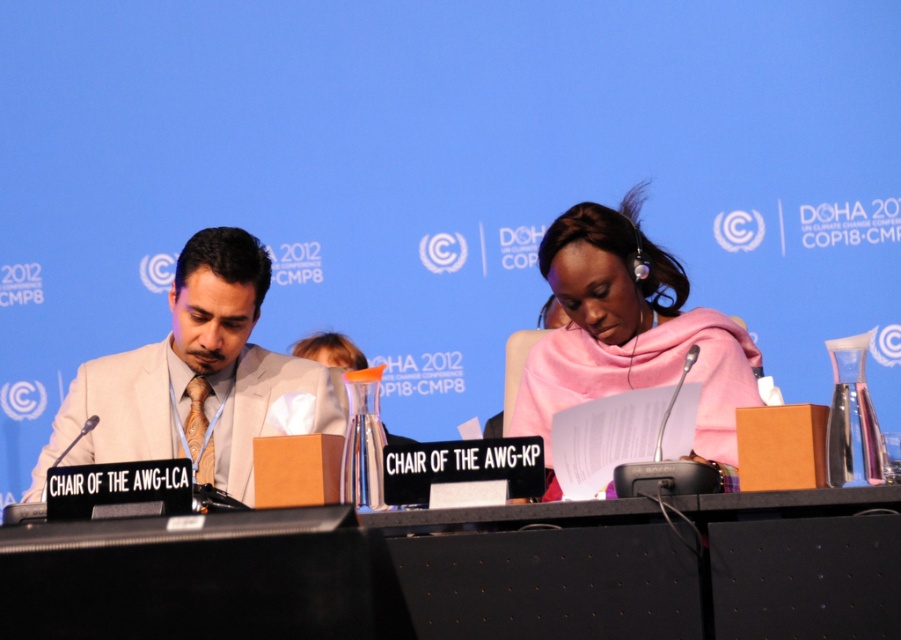
From the picture: You are organizing a small event and need to place a 1.5 meter wide screen behind the black plastic table at center. Considering the space occupied by the white satin suit at center, will there be enough room for the screen?

The black plastic table at center occupies less space than the white satin suit at center. Since the white satin suit at center takes up more space, there might not be enough room for the 1.5 meter wide screen behind the table. Check the available space carefully.

You are an event photographer at the COP18 conference. You need to ensure that the white satin suit at center and the pink fabric scarf at center are both visible in your photo. Based on their heights, which one might require you to adjust your camera angle to capture fully?

The white satin suit at center has a lesser height compared to the pink fabric scarf at center, so you might need to adjust your camera angle to ensure the taller pink fabric scarf at center is fully captured without being cut off.

You are attending the COP18 conference and notice two items at the center of the image. Which object is positioned to the left of the other? The items are the black plastic table at center and the pink fabric scarf at center.

The black plastic table at center is positioned to the left of the pink fabric scarf at center.